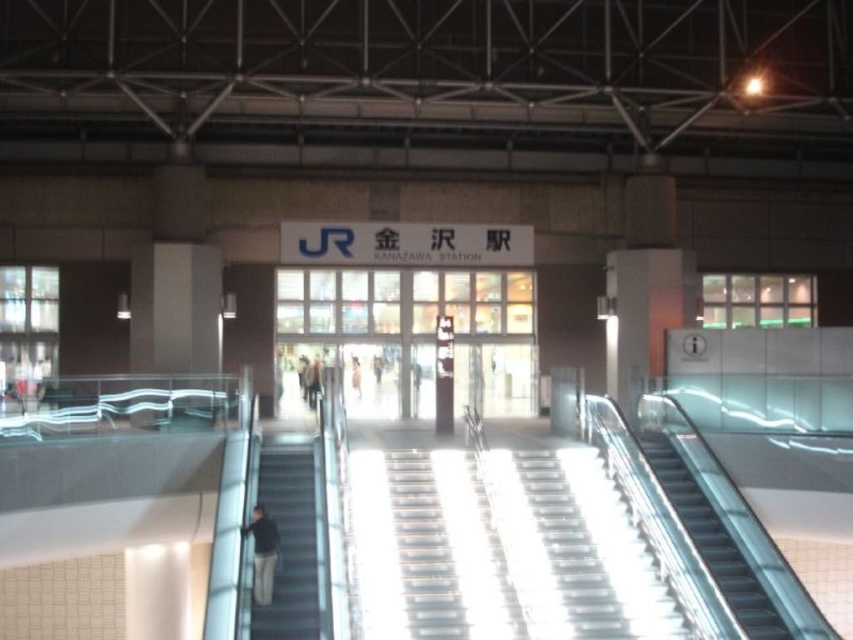
The image size is (853, 640). Describe the element at coordinates (711, 540) in the screenshot. I see `metallic escalator at right` at that location.

Is point (672, 506) positioned behind point (260, 556)?

Yes.

This screenshot has width=853, height=640. What do you see at coordinates (711, 540) in the screenshot? I see `metallic escalator at right` at bounding box center [711, 540].

I want to click on metallic escalator at right, so click(x=711, y=540).

Is metallic gray escalator at lower left shorter than dark gray jacket at lower left?

Incorrect, metallic gray escalator at lower left's height does not fall short of dark gray jacket at lower left's.

Between point (297, 460) and point (265, 604), which one is positioned behind?

Positioned behind is point (297, 460).

In order to click on metallic gray escalator at lower left in this screenshot , I will do `click(289, 538)`.

This screenshot has width=853, height=640. Find the location of `metallic gray escalator at lower left`. metallic gray escalator at lower left is located at coordinates (289, 538).

How much distance is there between metallic gray escalator at lower left and metallic escalator at right?

A distance of 8.27 meters exists between metallic gray escalator at lower left and metallic escalator at right.

Does metallic gray escalator at lower left appear on the left side of metallic escalator at right?

Correct, you'll find metallic gray escalator at lower left to the left of metallic escalator at right.

Where is `metallic gray escalator at lower left`? metallic gray escalator at lower left is located at coordinates (289, 538).

Where is `metallic gray escalator at lower left`? The image size is (853, 640). metallic gray escalator at lower left is located at coordinates (289, 538).